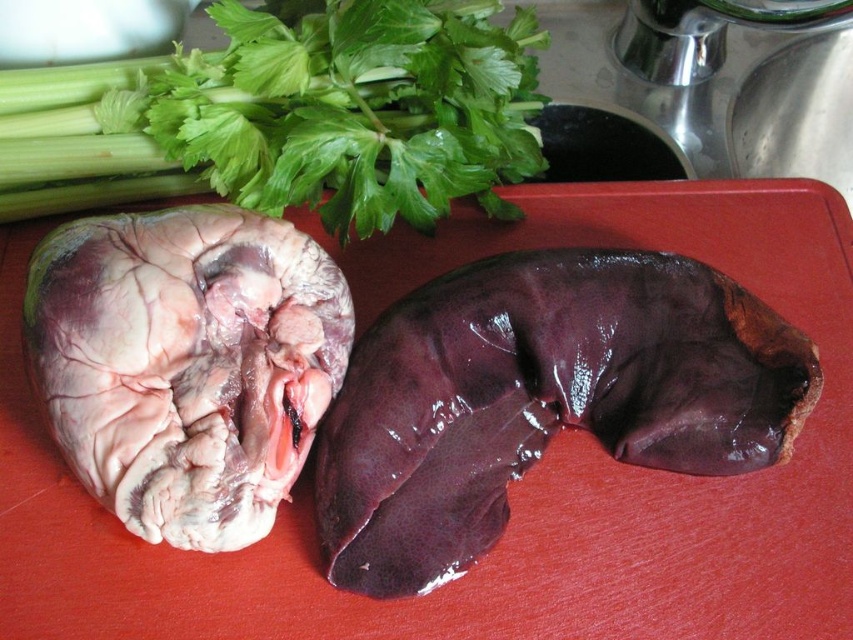
You are a chef preparing a dish and need to arrange the pinkish white flesh at center and the green leafy vegetable at upper left on a plate. Based on their positions in the image, which object is closer to you?

The green leafy vegetable at upper left is closer to you because the pinkish white flesh at center is behind it.

Looking at this image, you are a chef preparing a dish and need to place the green leafy vegetable at upper left and the pinkish white flesh at center on a plate. The plate has a diameter of 10 inches. Can you fit both items on the plate without overlapping them?

The green leafy vegetable at upper left is 8.28 inches away from the pinkish white flesh at center. Since the plate has a diameter of 10 inches, the maximum distance between the two items on the plate would be 10 inches. Since 8.28 inches is less than 10 inches, both items can fit on the plate without overlapping.